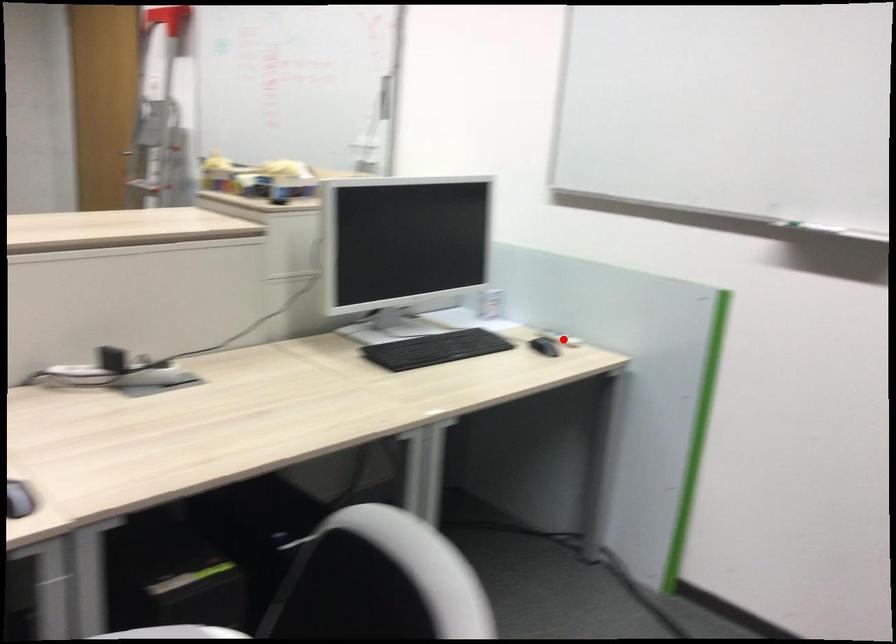
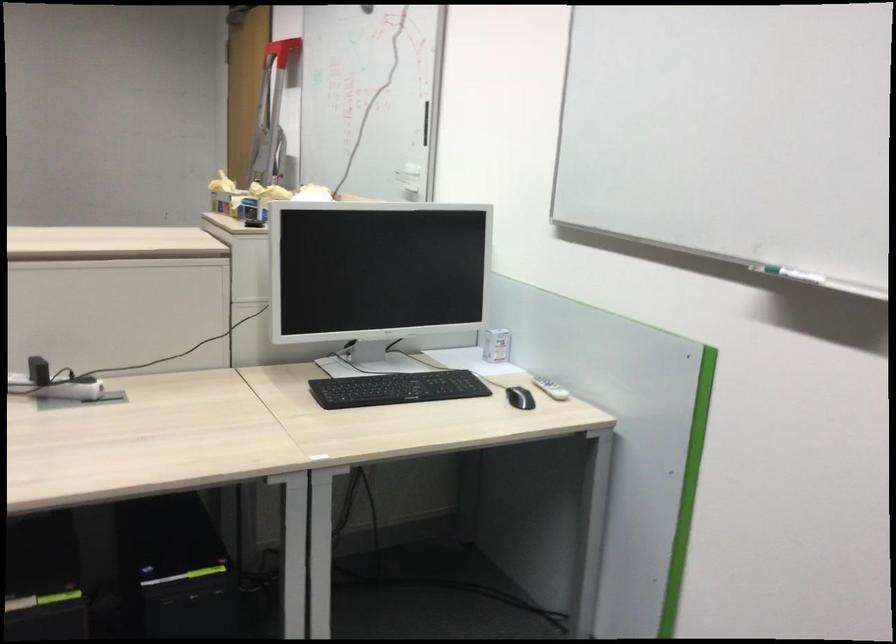
Find the pixel in the second image that matches the highlighted location in the first image.

(550, 388)